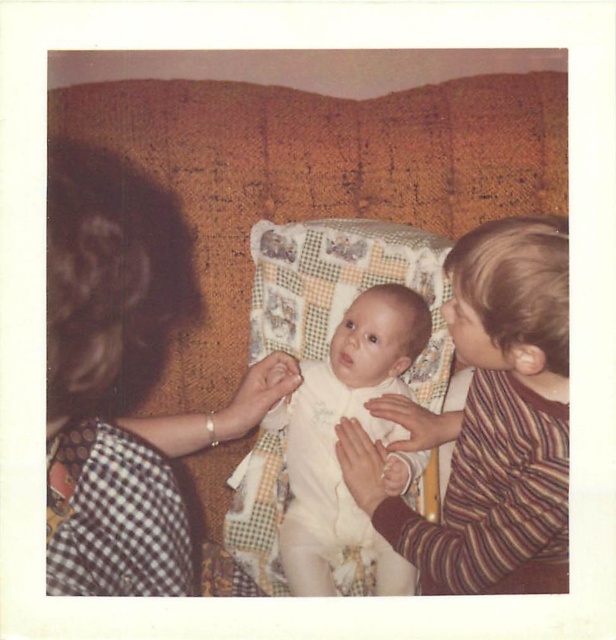
Question: Which point is closer to the camera taking this photo?

Choices:
 (A) (160, 454)
 (B) (293, 470)

Answer: (A)

Question: Can you confirm if black dotted dress at left is positioned to the right of white smooth onesie at center?

Choices:
 (A) yes
 (B) no

Answer: (B)

Question: Does black dotted dress at left appear on the right side of white smooth onesie at center?

Choices:
 (A) yes
 (B) no

Answer: (B)

Question: Can you confirm if black dotted dress at left is positioned to the left of white smooth onesie at center?

Choices:
 (A) yes
 (B) no

Answer: (A)